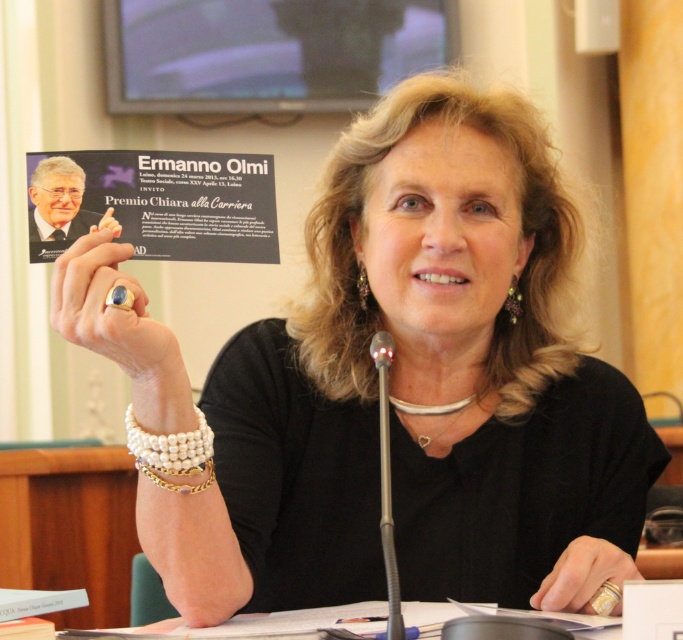
Which of these two, black plastic microphone at center or pearl/leather bracelet at upper center, stands shorter?

Standing shorter between the two is pearl/leather bracelet at upper center.

Is black plastic microphone at center to the right of pearl/leather bracelet at upper center from the viewer's perspective?

Correct, you'll find black plastic microphone at center to the right of pearl/leather bracelet at upper center.

The height and width of the screenshot is (640, 683). Identify the location of black plastic microphone at center. (387, 483).

Between pearl/leather bracelet at upper center and gold/pearl bracelet at upper center, which one has less height?

With less height is gold/pearl bracelet at upper center.

Does point (206, 424) come farther from viewer compared to point (161, 481)?

Yes.

Does point (195, 467) come closer to viewer compared to point (209, 476)?

That is True.

The height and width of the screenshot is (640, 683). Find the location of `pearl/leather bracelet at upper center`. pearl/leather bracelet at upper center is located at coordinates (169, 448).

Is gold ring at center to the left of black plastic microphone at center from the viewer's perspective?

Indeed, gold ring at center is positioned on the left side of black plastic microphone at center.

Which is above, gold ring at center or black plastic microphone at center?

gold ring at center

Which is in front, point (113, 355) or point (387, 376)?

Point (113, 355)

Locate an element on the screen. gold ring at center is located at coordinates (111, 312).